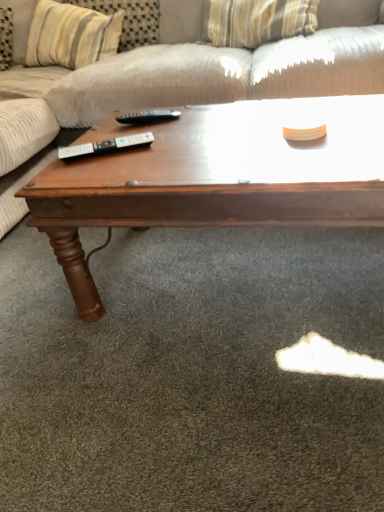
Question: From a real-world perspective, is dark wood coffee table at center beneath textured beige fabric couch at upper center?

Choices:
 (A) yes
 (B) no

Answer: (A)

Question: Is dark wood coffee table at center next to textured beige fabric couch at upper center and touching it?

Choices:
 (A) yes
 (B) no

Answer: (B)

Question: From the image's perspective, does dark wood coffee table at center appear lower than textured beige fabric couch at upper center?

Choices:
 (A) no
 (B) yes

Answer: (B)

Question: Is dark wood coffee table at center aimed at textured beige fabric couch at upper center?

Choices:
 (A) no
 (B) yes

Answer: (B)

Question: Can you confirm if dark wood coffee table at center is smaller than textured beige fabric couch at upper center?

Choices:
 (A) yes
 (B) no

Answer: (A)

Question: Is dark wood coffee table at center wider than textured beige fabric couch at upper center?

Choices:
 (A) yes
 (B) no

Answer: (B)

Question: From a real-world perspective, is textured beige fabric couch at upper center positioned under black plastic remote at center, the 1th remote from the back, based on gravity?

Choices:
 (A) no
 (B) yes

Answer: (B)

Question: Can you confirm if textured beige fabric couch at upper center is wider than black plastic remote at center, the 1th remote from the back?

Choices:
 (A) no
 (B) yes

Answer: (B)

Question: Can you confirm if textured beige fabric couch at upper center is thinner than black plastic remote at center, the first remote in the top-to-bottom sequence?

Choices:
 (A) yes
 (B) no

Answer: (B)

Question: Considering the relative sizes of textured beige fabric couch at upper center and black plastic remote at center, marked as the 2th remote in a bottom-to-top arrangement, in the image provided, is textured beige fabric couch at upper center smaller than black plastic remote at center, marked as the 2th remote in a bottom-to-top arrangement,?

Choices:
 (A) yes
 (B) no

Answer: (B)

Question: From the image's perspective, is textured beige fabric couch at upper center under black plastic remote at center, the 1th remote from the back?

Choices:
 (A) yes
 (B) no

Answer: (B)

Question: Is textured beige fabric couch at upper center to the right of black plastic remote at center, the 1th remote from the back, from the viewer's perspective?

Choices:
 (A) yes
 (B) no

Answer: (B)

Question: Considering the relative sizes of striped fabric pillow at upper center and textured beige fabric couch at upper center in the image provided, is striped fabric pillow at upper center smaller than textured beige fabric couch at upper center?

Choices:
 (A) no
 (B) yes

Answer: (B)